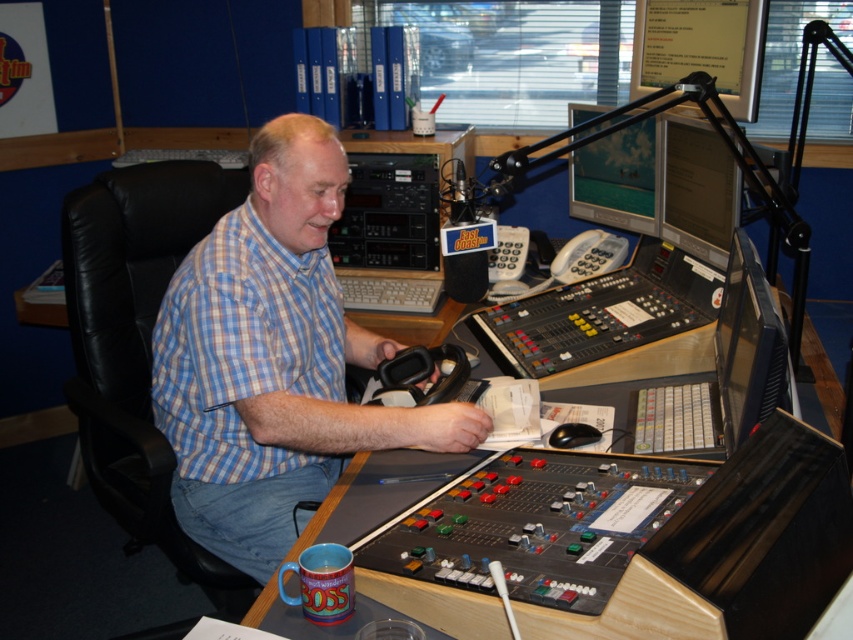
Question: Which object is the closest to the transparent plastic monitor at center-right?

Choices:
 (A) blue plaid shirt at center
 (B) wooden desk at center

Answer: (B)

Question: Which of the following is the farthest from the observer?

Choices:
 (A) (700, 566)
 (B) (126, 269)

Answer: (B)

Question: Is blue plaid shirt at center thinner than matte black monitor at upper right?

Choices:
 (A) yes
 (B) no

Answer: (B)

Question: Which of these objects is positioned closest to the black leather swivel chair at left?

Choices:
 (A) transparent plastic monitor at center-right
 (B) wooden desk at center
 (C) matte black monitor at upper right

Answer: (B)

Question: Is blue plaid shirt at center above matte black monitor at upper right?

Choices:
 (A) no
 (B) yes

Answer: (A)

Question: Is blue checkered shirt at center closer to camera compared to black leather swivel chair at left?

Choices:
 (A) yes
 (B) no

Answer: (A)